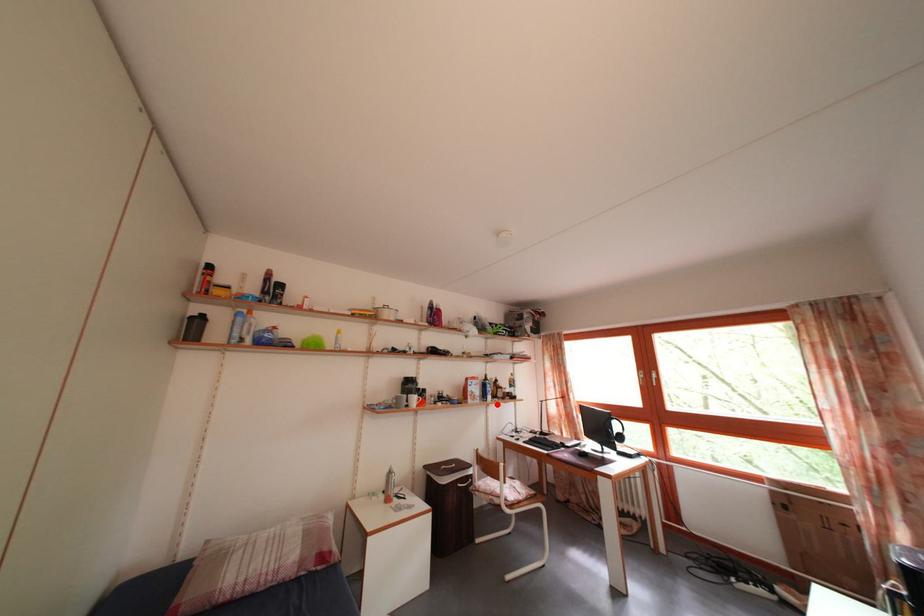
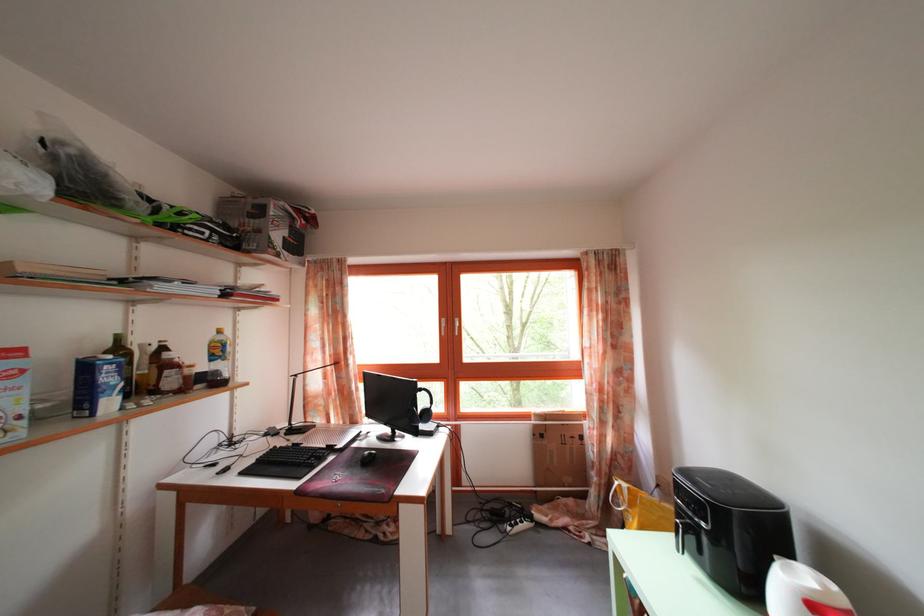
Locate, in the second image, the point that corresponds to the highlighted location in the first image.

(117, 410)